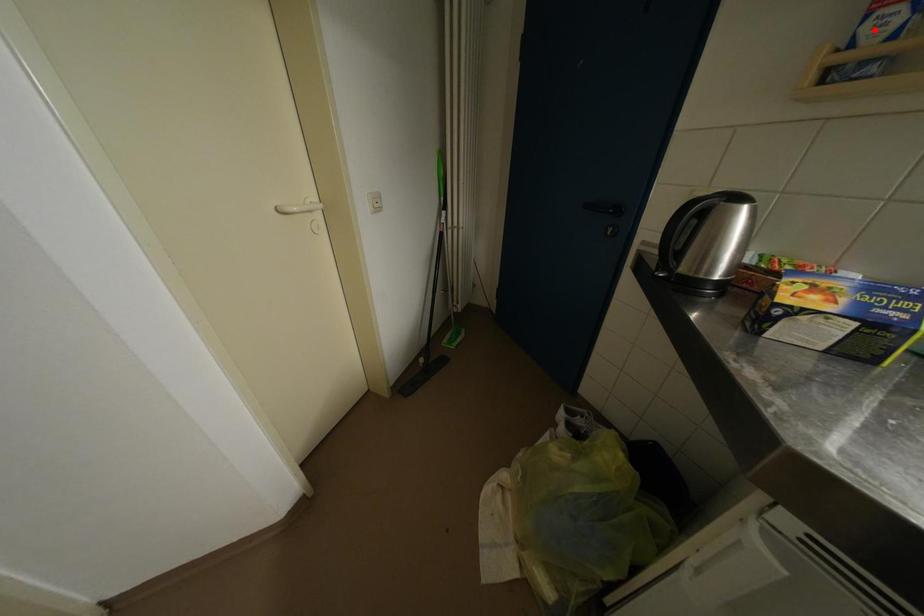
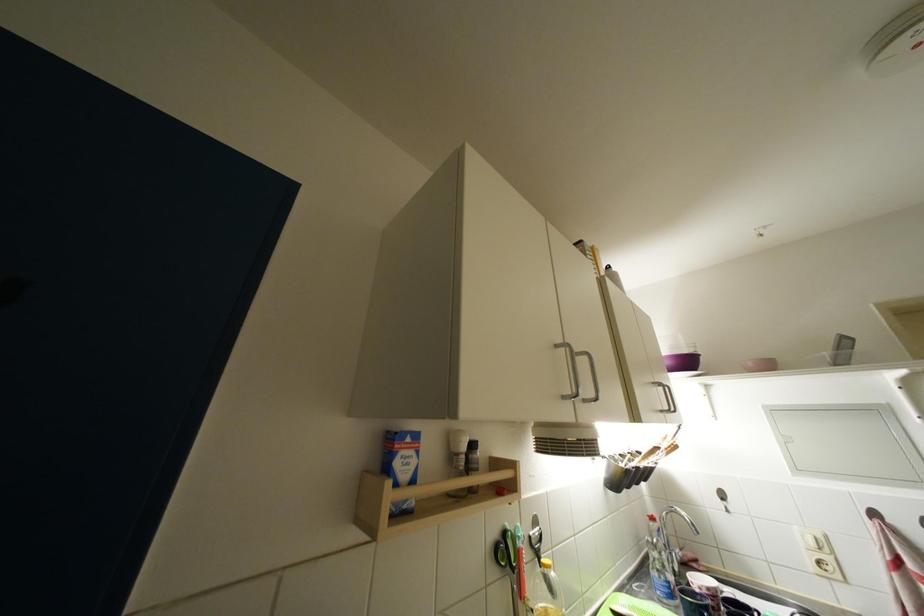
Question: I am providing you with two images of the same scene from different viewpoints. A red point is marked on the first image. At the location where the point appears in image 1, is it still visible in image 2?

Choices:
 (A) Yes
 (B) No

Answer: (A)